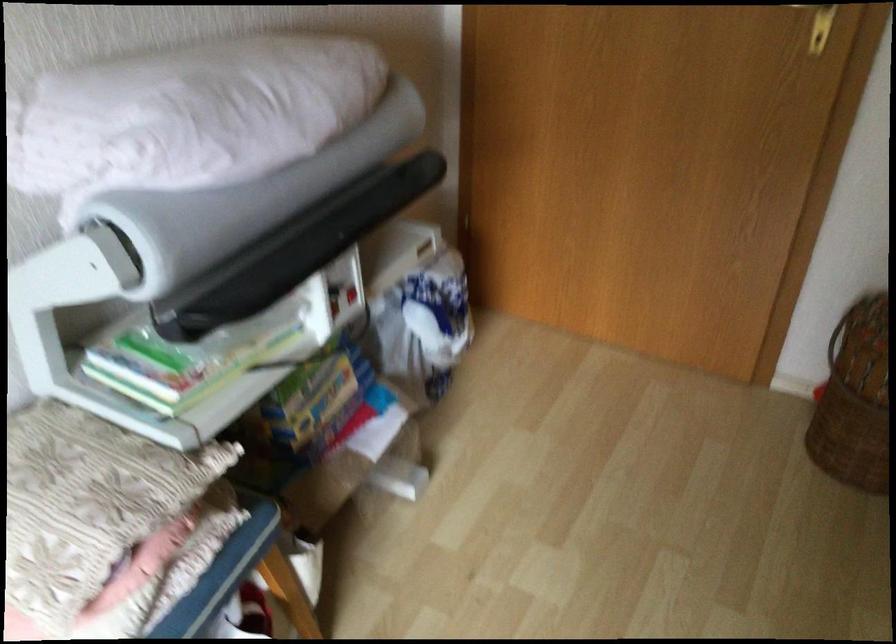
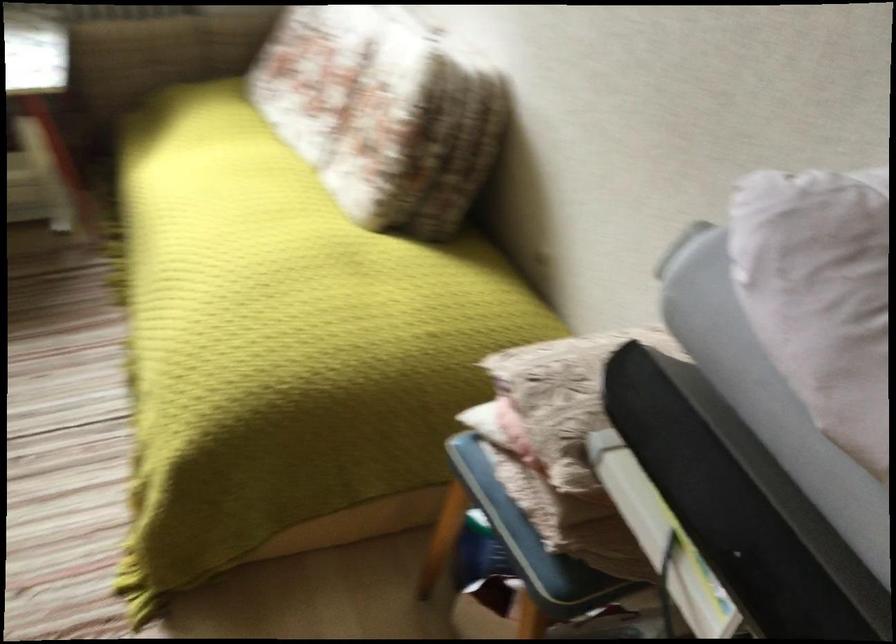
In the second image, find the point that corresponds to point 225,134 in the first image.

(821, 295)